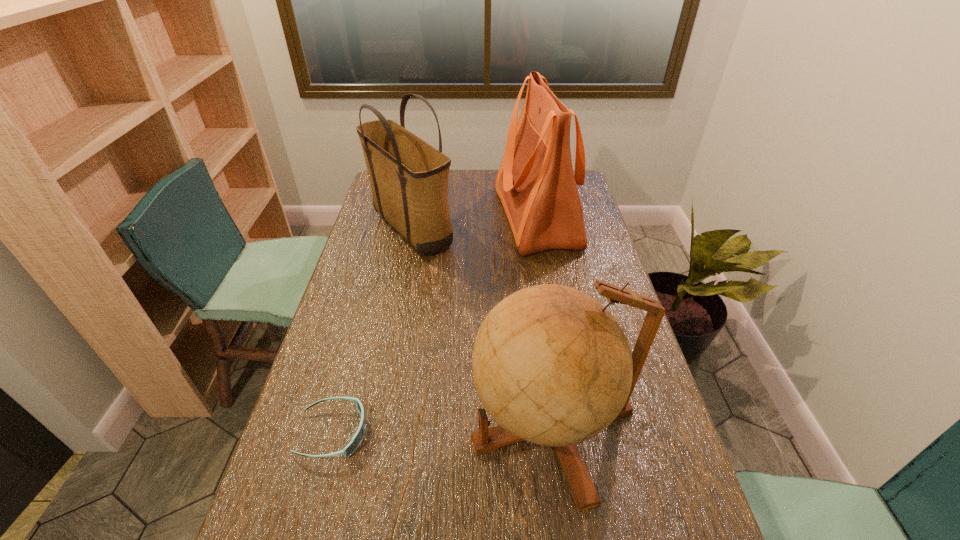
Identify the location of shopping bag. The width and height of the screenshot is (960, 540). (537, 187).

I want to click on tote bag, so click(409, 178).

Find the location of `globe`. globe is located at coordinates (551, 365).

The height and width of the screenshot is (540, 960). Identify the location of the shortest object. (356, 440).

I want to click on free space located on the front of the shopping bag, so click(546, 276).

The width and height of the screenshot is (960, 540). Identify the location of vacant space located on the right of the tote bag. (546, 228).

Where is `free region located on the surface of the globe`? Image resolution: width=960 pixels, height=540 pixels. free region located on the surface of the globe is located at coordinates (357, 426).

What are the coordinates of `vacant point located on the surface of the globe` in the screenshot? It's located at (302, 426).

Find the location of `free spot located on the surface of the globe`. free spot located on the surface of the globe is located at coordinates (306, 426).

At what (x,y) coordinates should I click in order to perform the action: click on vacant space located on the front-facing side of the shortest object. Please return your answer as a coordinate pair (x, y). Looking at the image, I should click on (441, 433).